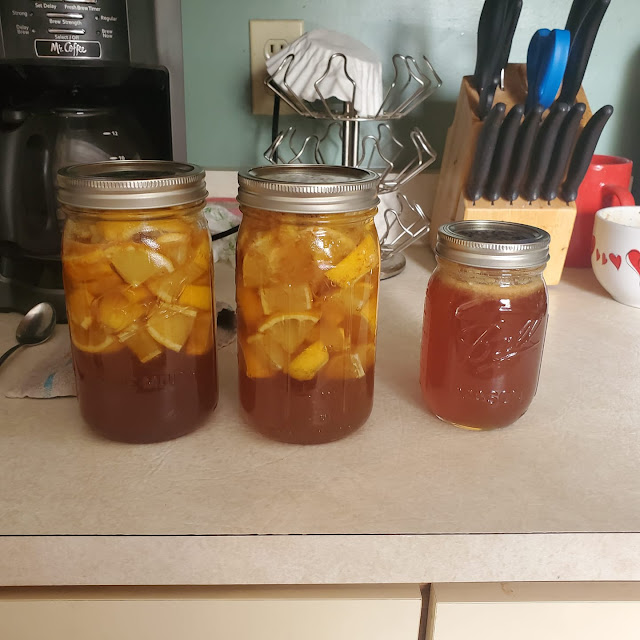
Identify the location of jar. (304, 397).